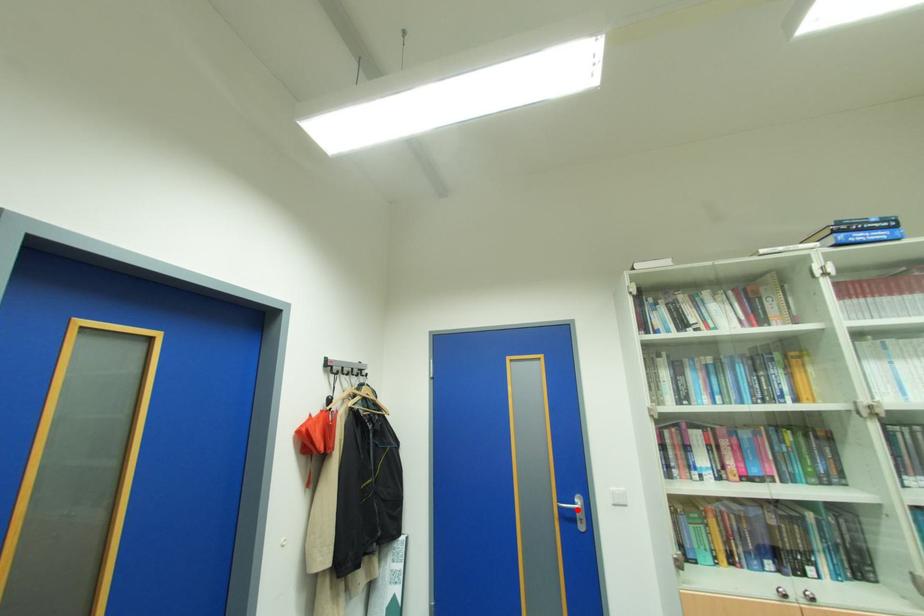
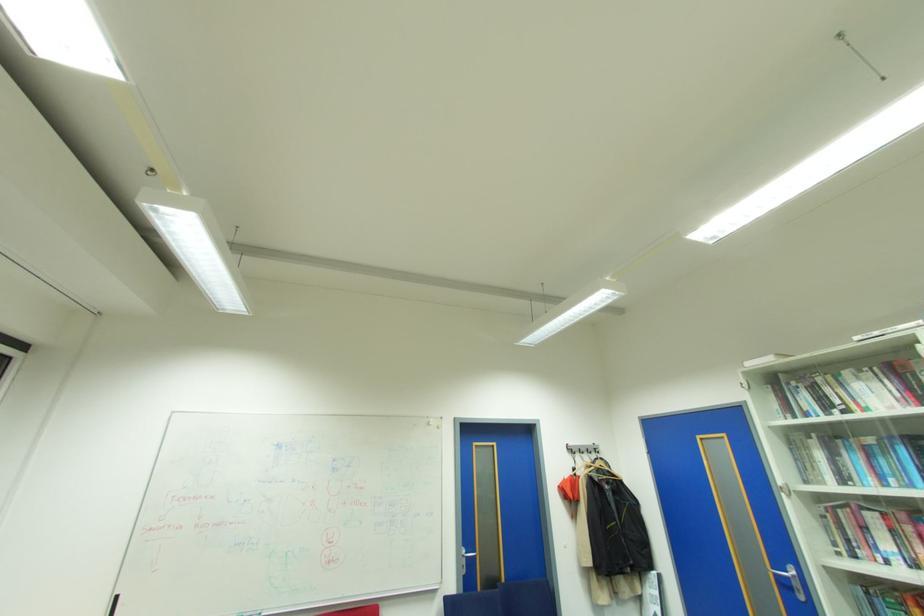
In the second image, find the point that corresponds to the highlighted location in the first image.

(791, 578)